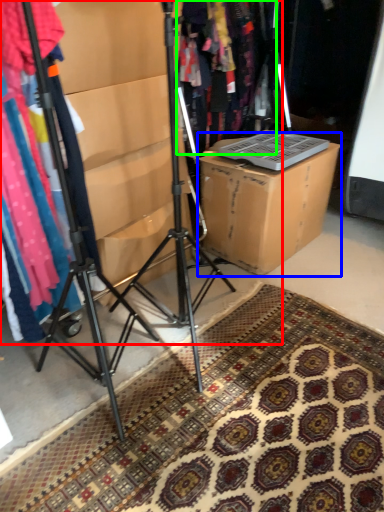
Question: Considering the real-world distances, which object is farthest from closet (highlighted by a red box)? cardboard box (highlighted by a blue box) or clothing (highlighted by a green box)?

Choices:
 (A) cardboard box
 (B) clothing

Answer: (B)